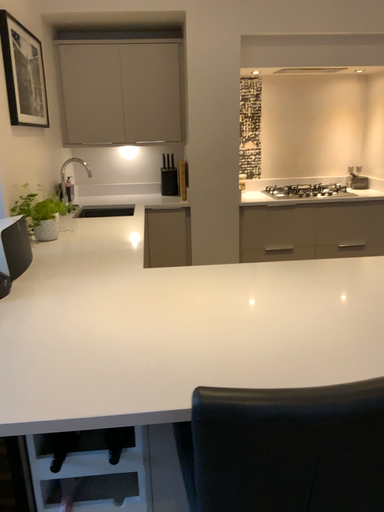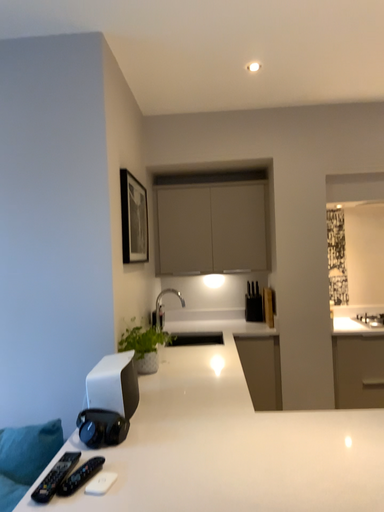
Question: Which way did the camera rotate in the video?

Choices:
 (A) rotated right
 (B) rotated left

Answer: (B)